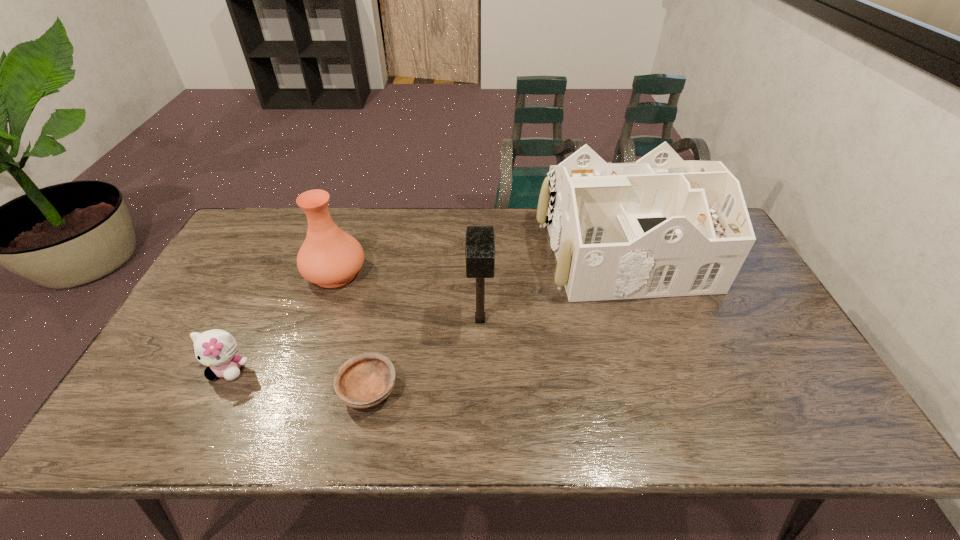
Where is `vacant region at the right edge`? vacant region at the right edge is located at coordinates (752, 334).

Identify the location of vacant space that is in between the dollhouse and the fourth object from left to right. (551, 286).

The image size is (960, 540). I want to click on vacant region between the shortest object and the dollhouse, so click(495, 321).

At what (x,y) coordinates should I click in order to perform the action: click on empty space between the shortest object and the leftmost object. Please return your answer as a coordinate pair (x, y). Looking at the image, I should click on (299, 380).

Locate an element on the screen. The height and width of the screenshot is (540, 960). free point between the dollhouse and the mallet is located at coordinates (551, 286).

Identify the location of free space between the kitten and the vase. Image resolution: width=960 pixels, height=540 pixels. (282, 321).

Locate an element on the screen. The width and height of the screenshot is (960, 540). vacant region between the mallet and the rightmost object is located at coordinates (551, 286).

In order to click on vacant point located between the bowl and the fourth object from right to left in this screenshot , I will do `click(352, 331)`.

Locate an element on the screen. This screenshot has width=960, height=540. vacant space that is in between the second object from right to left and the dollhouse is located at coordinates (551, 286).

Locate an element on the screen. vacant space that is in between the fourth object from left to right and the third object from right to left is located at coordinates tap(424, 355).